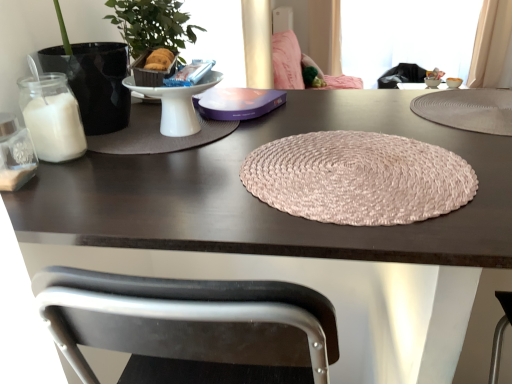
Question: From a real-world perspective, is beige fabric curtain at upper right on top of transparent plastic window screen at upper right?

Choices:
 (A) no
 (B) yes

Answer: (A)

Question: Does beige fabric curtain at upper right have a greater width compared to transparent plastic window screen at upper right?

Choices:
 (A) no
 (B) yes

Answer: (A)

Question: Is there a large distance between beige fabric curtain at upper right and transparent plastic window screen at upper right?

Choices:
 (A) no
 (B) yes

Answer: (A)

Question: Is beige fabric curtain at upper right oriented away from transparent plastic window screen at upper right?

Choices:
 (A) no
 (B) yes

Answer: (A)

Question: Can you confirm if beige fabric curtain at upper right is smaller than transparent plastic window screen at upper right?

Choices:
 (A) yes
 (B) no

Answer: (A)

Question: From the image's perspective, is beige fabric curtain at upper right located beneath transparent plastic window screen at upper right?

Choices:
 (A) no
 (B) yes

Answer: (B)

Question: From a real-world perspective, is transparent plastic window screen at upper right under pink woven placemat at center?

Choices:
 (A) no
 (B) yes

Answer: (B)

Question: Is transparent plastic window screen at upper right not inside pink woven placemat at center?

Choices:
 (A) yes
 (B) no

Answer: (A)

Question: Is transparent plastic window screen at upper right not close to pink woven placemat at center?

Choices:
 (A) no
 (B) yes

Answer: (B)

Question: Is transparent plastic window screen at upper right behind pink woven placemat at center?

Choices:
 (A) yes
 (B) no

Answer: (A)

Question: Would you say pink woven placemat at center is part of transparent plastic window screen at upper right's contents?

Choices:
 (A) yes
 (B) no

Answer: (B)

Question: Does transparent plastic window screen at upper right have a smaller size compared to pink woven placemat at center?

Choices:
 (A) yes
 (B) no

Answer: (B)

Question: Is pink woven placemat at center oriented away from transparent plastic window screen at upper right?

Choices:
 (A) no
 (B) yes

Answer: (A)